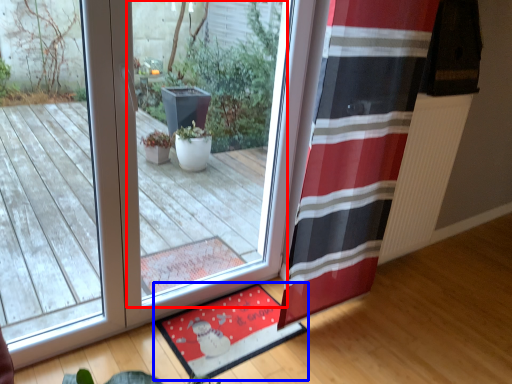
Question: Which of the following is the farthest to the observer, window (highlighted by a red box) or mat (highlighted by a blue box)?

Choices:
 (A) window
 (B) mat

Answer: (B)